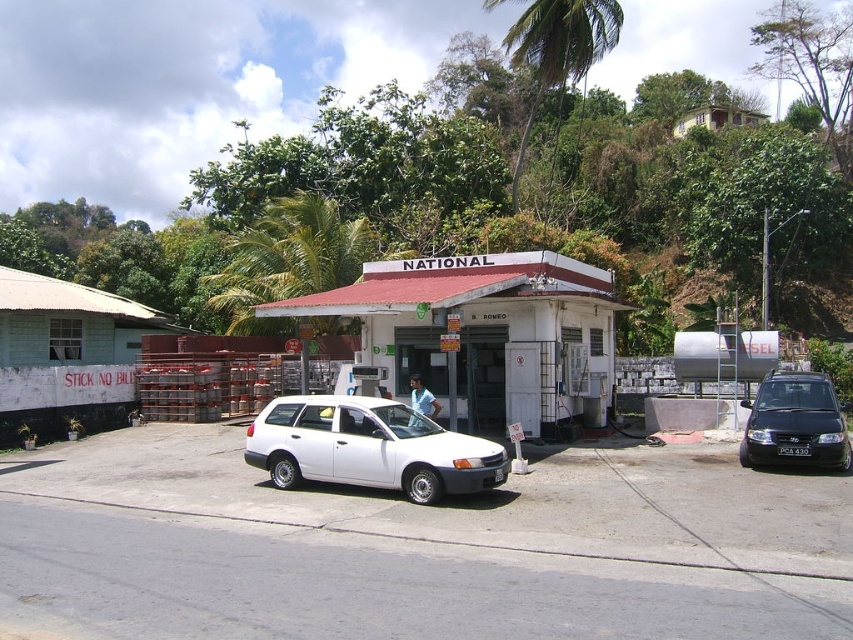
You are a delivery driver who needs to park your vehicle in the parking area in front of the National gas station. You have a white matte wagon at center and a black matte van at right. Which vehicle is closer to the entrance of the gas station?

The white matte wagon at center is closer to the entrance of the gas station because it is positioned below the black matte van at right, indicating it is lower in the image and thus closer to the entrance.

You are driving a delivery truck and need to park your vehicle between the white matte wagon at center and the black matte van at right. The parking space between them is narrow. Can you safely park your truck there if your truck is 18 feet long?

The distance between the white matte wagon at center and the black matte van at right is 19.26 feet. Since your truck is 18 feet long, there is enough space to park safely as the available space is slightly longer than the truck.

You are standing at the entrance of the National gas station and see two points marked in the image. The first point is at coordinates point (x=416, y=458) and the second point is at point (x=828, y=388). Which point is closer to you?

Point (x=416, y=458) is in front of point (x=828, y=388), so it is closer to you.